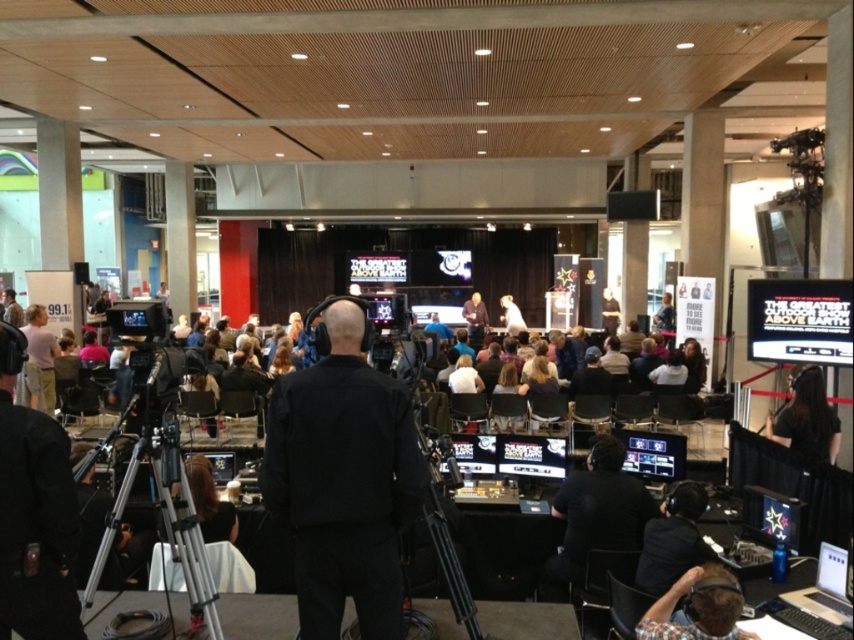
Does black matte jacket at center have a lesser width compared to black hair at center?

Incorrect, black matte jacket at center's width is not less than black hair at center's.

Which is above, black matte jacket at center or black hair at center?

black matte jacket at center is above.

At what (x,y) coordinates should I click in order to perform the action: click on black matte jacket at center. Please return your answer as a coordinate pair (x, y). The width and height of the screenshot is (854, 640). Looking at the image, I should click on (343, 477).

You are a GUI agent. You are given a task and a screenshot of the screen. Output one action in this format:
    pyautogui.click(x=<x>, y=<y>)
    Task: Click on the black matte jacket at center
    Image resolution: width=854 pixels, height=640 pixels.
    Given the screenshot: What is the action you would take?
    pyautogui.click(x=343, y=477)

Does black matte jacket at center appear under plaid shirt at lower right?

Actually, black matte jacket at center is above plaid shirt at lower right.

Is point (303, 445) closer to viewer compared to point (703, 582)?

Yes, point (303, 445) is in front of point (703, 582).

Is point (328, 518) positioned in front of point (670, 604)?

Yes, it is in front of point (670, 604).

Where is `black matte jacket at center`? The image size is (854, 640). black matte jacket at center is located at coordinates (343, 477).

Is point (7, 419) behind point (794, 384)?

That is False.

Consider the image. Measure the distance from black matte camera at left to black hair at center.

black matte camera at left is 4.73 meters from black hair at center.

The width and height of the screenshot is (854, 640). I want to click on black matte camera at left, so click(x=34, y=513).